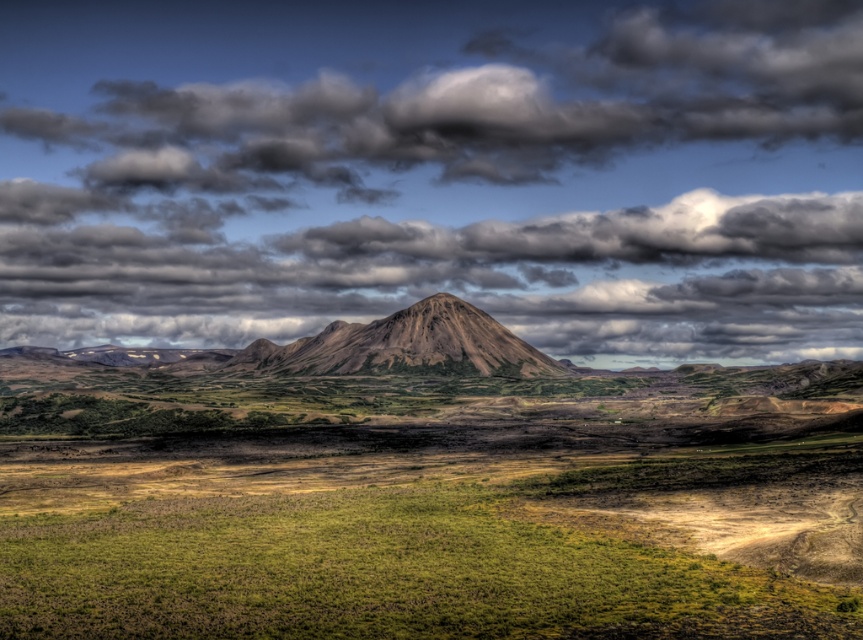
Question: Which of the following is the farthest from the observer?

Choices:
 (A) cloudy sky at upper center
 (B) brown textured mountain at center

Answer: (A)

Question: Which of the following is the farthest from the observer?

Choices:
 (A) (484, 205)
 (B) (421, 524)

Answer: (A)

Question: From the image, what is the correct spatial relationship of cloudy sky at upper center in relation to green grassy field at lower center?

Choices:
 (A) right
 (B) left

Answer: (B)

Question: Can you confirm if green grassy field at lower center is wider than brown textured mountain at center?

Choices:
 (A) no
 (B) yes

Answer: (A)

Question: Is cloudy sky at upper center in front of brown textured mountain at center?

Choices:
 (A) no
 (B) yes

Answer: (A)

Question: Which point is closer to the camera?

Choices:
 (A) (74, 266)
 (B) (673, 582)

Answer: (B)